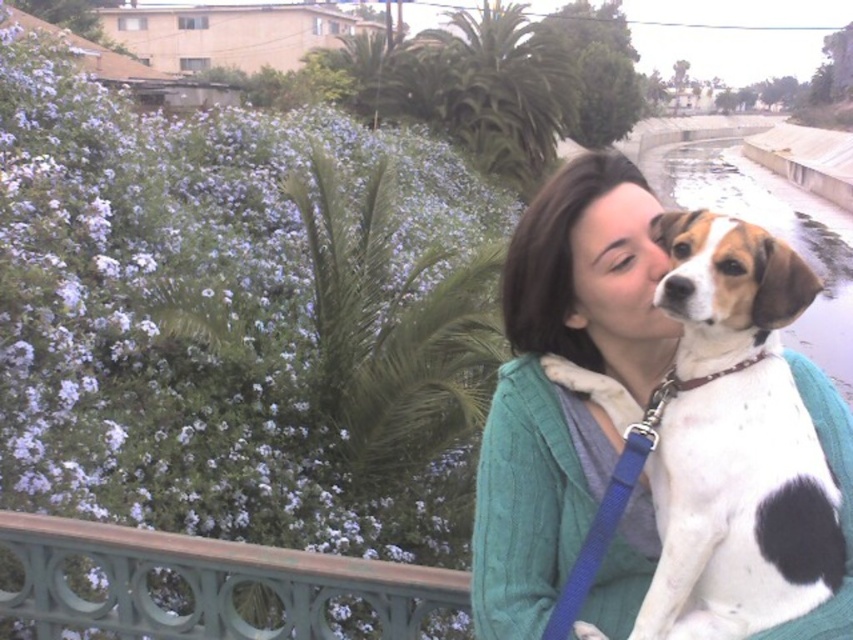
Can you confirm if purple matte flowers at upper left is bigger than green painted metal railing at lower left?

No.

Is point (341, 372) closer to viewer compared to point (303, 627)?

No.

Where is `purple matte flowers at upper left`? Image resolution: width=853 pixels, height=640 pixels. purple matte flowers at upper left is located at coordinates (229, 323).

Does purple matte flowers at upper left have a larger size compared to white-spotted fur dog at center?

Actually, purple matte flowers at upper left might be smaller than white-spotted fur dog at center.

Can you confirm if purple matte flowers at upper left is smaller than white-spotted fur dog at center?

Correct, purple matte flowers at upper left occupies less space than white-spotted fur dog at center.

Identify the location of purple matte flowers at upper left. [229, 323].

Find the location of a particular element. The height and width of the screenshot is (640, 853). purple matte flowers at upper left is located at coordinates (229, 323).

Between white-spotted fur dog at center and green painted metal railing at lower left, which one appears on the right side from the viewer's perspective?

Positioned to the right is white-spotted fur dog at center.

Can you confirm if white-spotted fur dog at center is positioned below green painted metal railing at lower left?

No.

What do you see at coordinates (735, 442) in the screenshot? I see `white-spotted fur dog at center` at bounding box center [735, 442].

The height and width of the screenshot is (640, 853). Find the location of `white-spotted fur dog at center`. white-spotted fur dog at center is located at coordinates (735, 442).